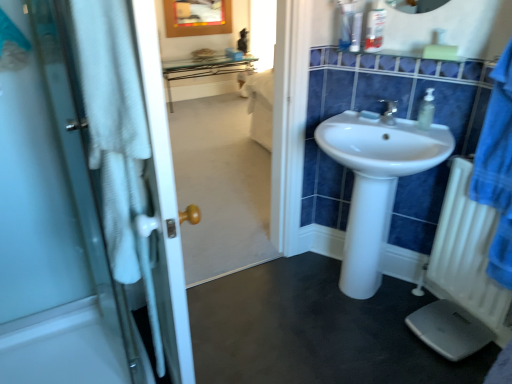
At what (x,y) coordinates should I click in order to perform the action: click on free space in front of white glossy sink at center. Please return your answer as a coordinate pair (x, y). The image size is (512, 384). Looking at the image, I should click on (362, 354).